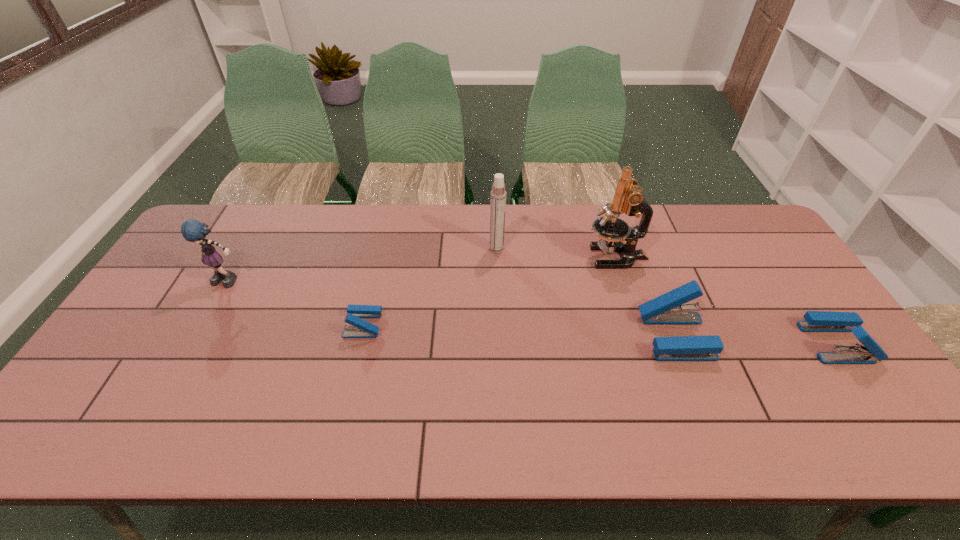
Please mark a free spot for a new stapler_(stapling_machine) to balance the arrangement. Please provide its 2D coordinates. Your answer should be formatted as a tuple, i.e. [(x, y)], where the tuple contains the x and y coordinates of a point satisfying the conditions above.

[(517, 331)]